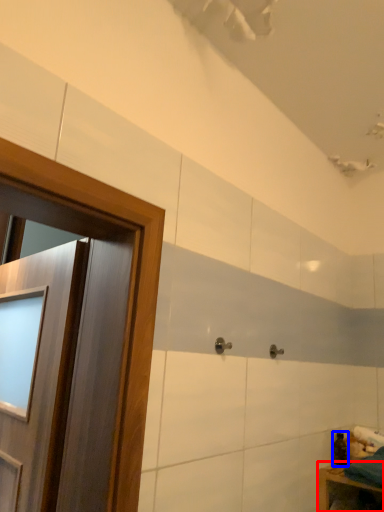
Question: Which of the following is the closest to the observer, furniture (highlighted by a red box) or toiletry (highlighted by a blue box)?

Choices:
 (A) furniture
 (B) toiletry

Answer: (A)